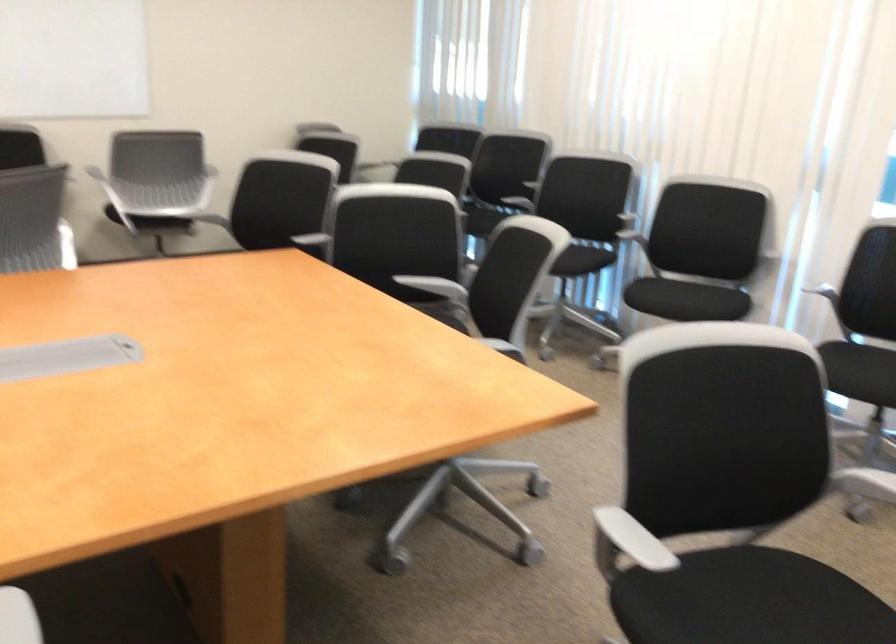
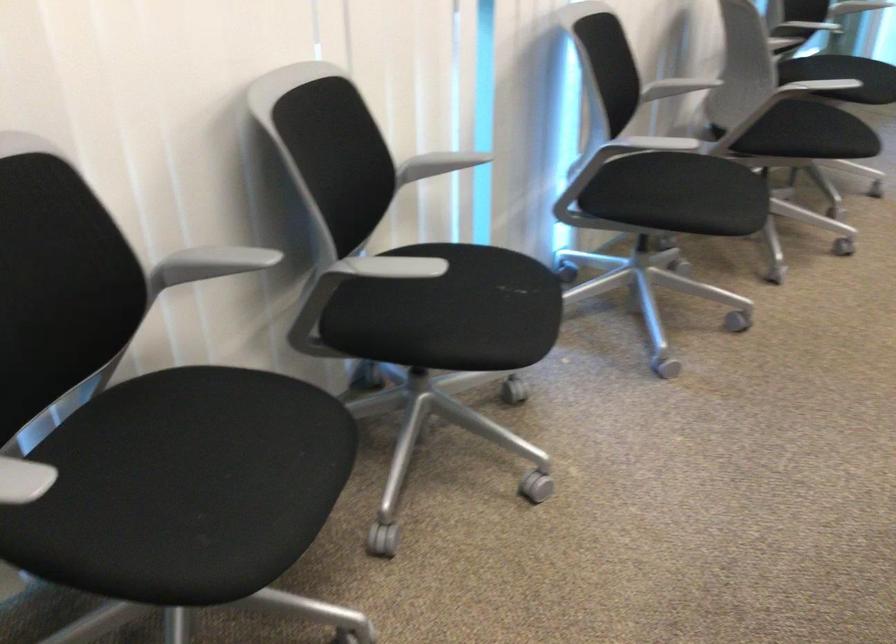
Locate, in the second image, the point that corresponds to (692,299) in the first image.

(515, 287)